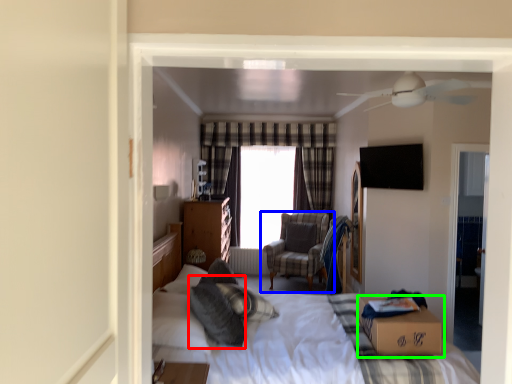
Question: Considering the real-world distances, which object is farthest from pillow (highlighted by a red box)? chair (highlighted by a blue box) or box (highlighted by a green box)?

Choices:
 (A) chair
 (B) box

Answer: (A)